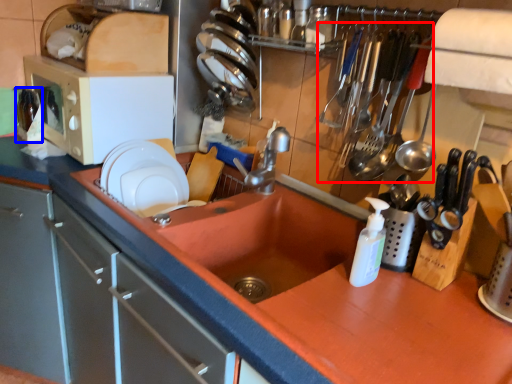
Question: Which object is further to the camera taking this photo, silverware (highlighted by a red box) or bottle (highlighted by a blue box)?

Choices:
 (A) silverware
 (B) bottle

Answer: (B)